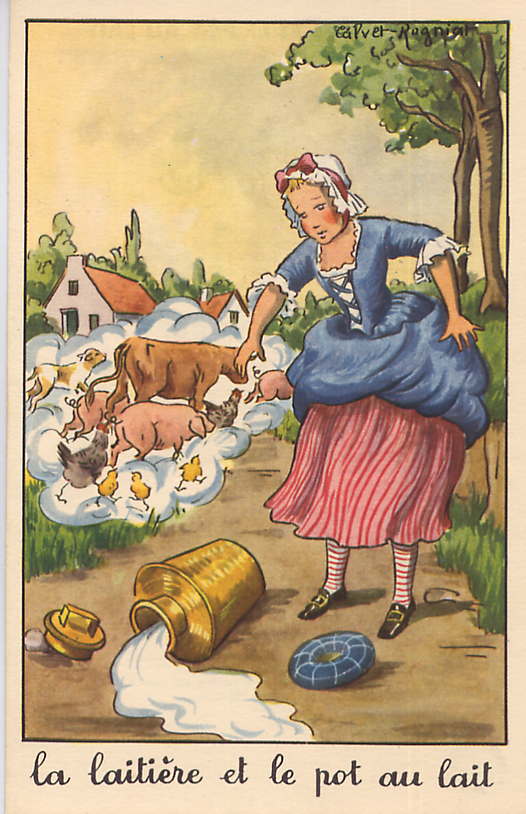
Where is `pot`? pot is located at coordinates [229, 585].